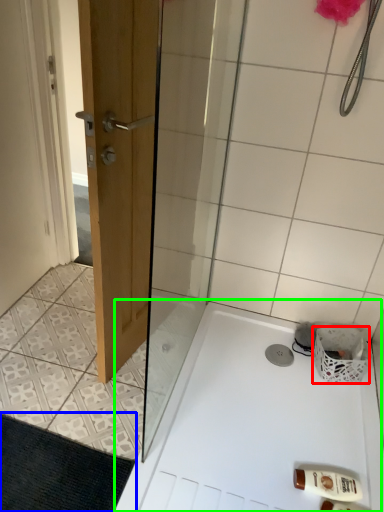
Question: Estimate the real-world distances between objects in this image. Which object is farther from basket (highlighted by a red box), bath mat (highlighted by a blue box) or bath (highlighted by a green box)?

Choices:
 (A) bath mat
 (B) bath

Answer: (A)